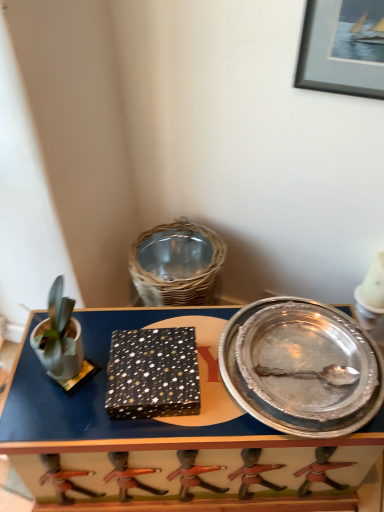
Question: From the image's perspective, would you say black matte picture frame at upper right is positioned over silver/metallic platter at right?

Choices:
 (A) yes
 (B) no

Answer: (A)

Question: Considering the relative sizes of black matte picture frame at upper right and silver/metallic platter at right in the image provided, is black matte picture frame at upper right wider than silver/metallic platter at right?

Choices:
 (A) yes
 (B) no

Answer: (B)

Question: Is black matte picture frame at upper right further to camera compared to silver/metallic platter at right?

Choices:
 (A) no
 (B) yes

Answer: (A)

Question: Does black matte picture frame at upper right have a lesser height compared to silver/metallic platter at right?

Choices:
 (A) no
 (B) yes

Answer: (A)

Question: Is black matte picture frame at upper right thinner than silver/metallic platter at right?

Choices:
 (A) no
 (B) yes

Answer: (B)

Question: Does black matte picture frame at upper right contain silver/metallic platter at right?

Choices:
 (A) no
 (B) yes

Answer: (A)

Question: Is silver/metallic platter at right oriented away from metallic silver tray at center?

Choices:
 (A) no
 (B) yes

Answer: (A)

Question: Is silver/metallic platter at right bigger than metallic silver tray at center?

Choices:
 (A) no
 (B) yes

Answer: (A)

Question: Does silver/metallic platter at right appear on the right side of metallic silver tray at center?

Choices:
 (A) yes
 (B) no

Answer: (A)

Question: Would you consider silver/metallic platter at right to be distant from metallic silver tray at center?

Choices:
 (A) yes
 (B) no

Answer: (B)

Question: From a real-world perspective, does silver/metallic platter at right sit lower than metallic silver tray at center?

Choices:
 (A) yes
 (B) no

Answer: (B)

Question: Does silver/metallic platter at right have a smaller size compared to metallic silver tray at center?

Choices:
 (A) yes
 (B) no

Answer: (A)

Question: Does black matte picture frame at upper right turn towards metallic silver tray at center?

Choices:
 (A) yes
 (B) no

Answer: (B)